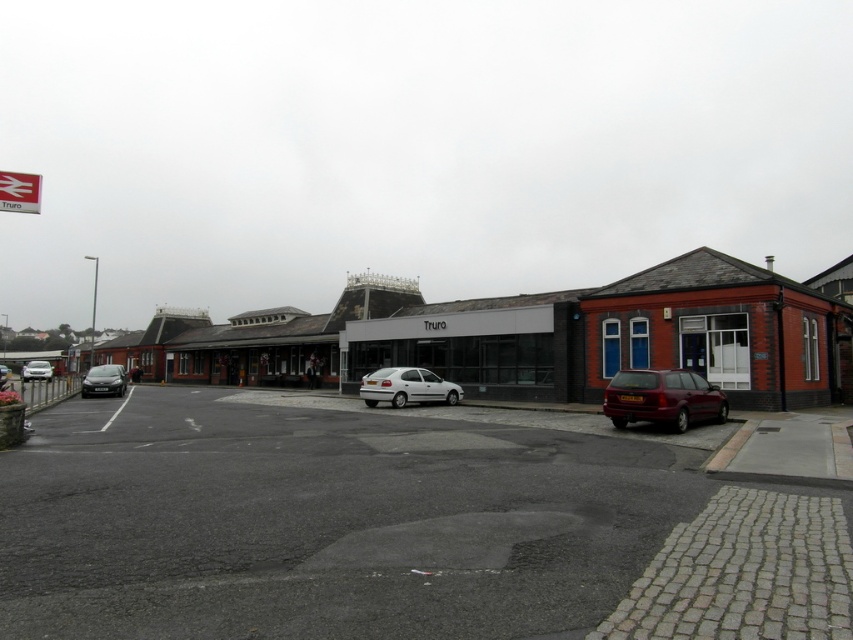
You are a pedestrian standing at the edge of the paved area near the cobblestone border. You want to walk to the red brick building at right. Which direction should you walk relative to the matte black car at center?

The red brick building at right is positioned on the right side of matte black car at center, so you should walk to the right of the matte black car at center to reach the red brick building at right.

You are standing at the train station in Truro and want to locate the brick building at center. According to the coordinates provided, where exactly should you look?

The brick building at center is located at coordinates point [537,337].

You are a delivery driver who needs to park your truck in the Truro station area. Your truck is 10 meters long. The parking area has a black asphalt parking lot at center and a matte black car at center. Can your truck fit between them without overlapping either?

The distance between the black asphalt parking lot at center and the matte black car at center is 24.77 meters. Since your truck is only 10 meters long, there is sufficient space to park between them without overlapping either object.